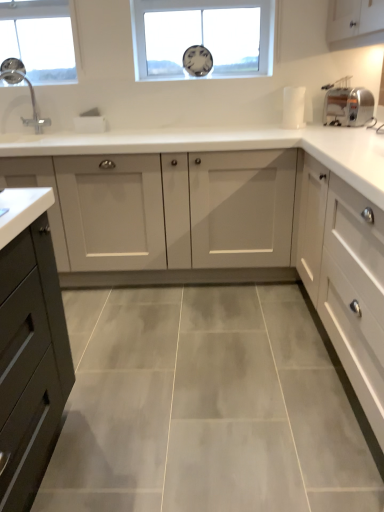
Question: Considering the relative sizes of clear glass window at upper left, the 2th window positioned from the right, and satin silver toaster at right in the image provided, is clear glass window at upper left, the 2th window positioned from the right, thinner than satin silver toaster at right?

Choices:
 (A) yes
 (B) no

Answer: (A)

Question: Could satin silver toaster at right be considered to be inside clear glass window at upper left, which ranks as the first window in left-to-right order?

Choices:
 (A) yes
 (B) no

Answer: (B)

Question: Considering the relative positions of clear glass window at upper left, which ranks as the first window in left-to-right order, and satin silver toaster at right in the image provided, is clear glass window at upper left, which ranks as the first window in left-to-right order, to the left of satin silver toaster at right from the viewer's perspective?

Choices:
 (A) yes
 (B) no

Answer: (A)

Question: Is clear glass window at upper left, which ranks as the first window in left-to-right order, directly adjacent to satin silver toaster at right?

Choices:
 (A) no
 (B) yes

Answer: (A)

Question: In terms of width, does satin silver toaster at right look wider or thinner when compared to white matte cabinet at right, the second cabinetry positioned from the back?

Choices:
 (A) thin
 (B) wide

Answer: (A)

Question: Based on their sizes in the image, would you say satin silver toaster at right is bigger or smaller than white matte cabinet at right, the second cabinetry positioned from the back?

Choices:
 (A) small
 (B) big

Answer: (A)

Question: Choose the correct answer: Is satin silver toaster at right inside white matte cabinet at right, the first cabinetry positioned from the front, or outside it?

Choices:
 (A) inside
 (B) outside

Answer: (B)

Question: From the image's perspective, is satin silver toaster at right located above or below white matte cabinet at right, the first cabinetry positioned from the front?

Choices:
 (A) below
 (B) above

Answer: (B)

Question: Is white matte cabinet at right, the first cabinetry positioned from the front, in front of or behind satin silver toaster at right in the image?

Choices:
 (A) behind
 (B) front

Answer: (B)

Question: Is white matte cabinet at right, the second cabinetry positioned from the back, inside the boundaries of satin silver toaster at right, or outside?

Choices:
 (A) outside
 (B) inside

Answer: (A)

Question: Considering the positions of white matte cabinet at right, the second cabinetry positioned from the back, and satin silver toaster at right in the image, is white matte cabinet at right, the second cabinetry positioned from the back, wider or thinner than satin silver toaster at right?

Choices:
 (A) thin
 (B) wide

Answer: (B)

Question: Considering the positions of point (362, 250) and point (329, 88), is point (362, 250) closer or farther from the camera than point (329, 88)?

Choices:
 (A) closer
 (B) farther

Answer: (A)

Question: Visually, is transparent glass clock at upper center, which is counted as the 1th window, starting from the right, positioned to the left or to the right of white matte cabinet at right, the first cabinetry positioned from the front?

Choices:
 (A) right
 (B) left

Answer: (B)

Question: From their relative heights in the image, would you say transparent glass clock at upper center, which is the second window from left to right, is taller or shorter than white matte cabinet at right, the first cabinetry positioned from the front?

Choices:
 (A) tall
 (B) short

Answer: (B)